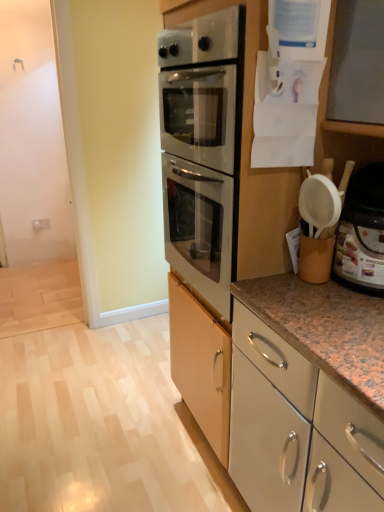
Question: Visually, is white plastic container at right positioned to the left or to the right of white glossy cabinet at lower right, the 1th cabinetry in the bottom-to-top sequence?

Choices:
 (A) left
 (B) right

Answer: (B)

Question: From a real-world perspective, is white plastic container at right physically located above or below white glossy cabinet at lower right, the 1th cabinetry in the bottom-to-top sequence?

Choices:
 (A) below
 (B) above

Answer: (B)

Question: Which object is the closest to the white plastic container at right?

Choices:
 (A) white glossy cabinet at lower right, arranged as the 2th cabinetry when viewed from the top
 (B) white glossy cabinet at center, which is counted as the first cabinetry, starting from the top

Answer: (B)

Question: Estimate the real-world distances between objects in this image. Which object is farther from the white glossy cabinet at center, which is counted as the second cabinetry, starting from the bottom?

Choices:
 (A) white glossy cabinet at lower right, arranged as the 2th cabinetry when viewed from the top
 (B) white plastic container at right

Answer: (B)